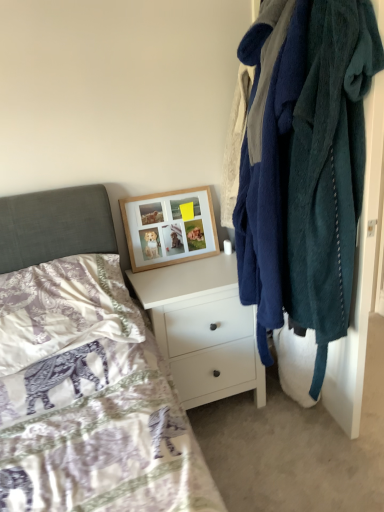
Question: Does white matte chest of drawers at center have a lesser width compared to teal fuzzy robe at right?

Choices:
 (A) yes
 (B) no

Answer: (B)

Question: Is white matte chest of drawers at center positioned far away from teal fuzzy robe at right?

Choices:
 (A) yes
 (B) no

Answer: (B)

Question: Is white matte chest of drawers at center positioned behind teal fuzzy robe at right?

Choices:
 (A) no
 (B) yes

Answer: (B)

Question: Is white matte chest of drawers at center oriented away from teal fuzzy robe at right?

Choices:
 (A) yes
 (B) no

Answer: (B)

Question: Considering the relative sizes of white matte chest of drawers at center and teal fuzzy robe at right in the image provided, is white matte chest of drawers at center taller than teal fuzzy robe at right?

Choices:
 (A) no
 (B) yes

Answer: (A)

Question: Is white matte chest of drawers at center located outside teal fuzzy robe at right?

Choices:
 (A) no
 (B) yes

Answer: (B)

Question: Is white matte chest of drawers at center next to purple satin pillow at lower left?

Choices:
 (A) yes
 (B) no

Answer: (B)

Question: Can you confirm if white matte chest of drawers at center is bigger than purple satin pillow at lower left?

Choices:
 (A) no
 (B) yes

Answer: (B)

Question: Does white matte chest of drawers at center come behind purple satin pillow at lower left?

Choices:
 (A) yes
 (B) no

Answer: (A)

Question: Can you confirm if white matte chest of drawers at center is thinner than purple satin pillow at lower left?

Choices:
 (A) yes
 (B) no

Answer: (B)

Question: Considering the relative sizes of white matte chest of drawers at center and purple satin pillow at lower left in the image provided, is white matte chest of drawers at center shorter than purple satin pillow at lower left?

Choices:
 (A) yes
 (B) no

Answer: (B)

Question: Considering the relative sizes of white matte chest of drawers at center and purple satin pillow at lower left in the image provided, is white matte chest of drawers at center smaller than purple satin pillow at lower left?

Choices:
 (A) yes
 (B) no

Answer: (B)

Question: Can you confirm if purple satin pillow at lower left is positioned to the left of white matte chest of drawers at center?

Choices:
 (A) no
 (B) yes

Answer: (B)